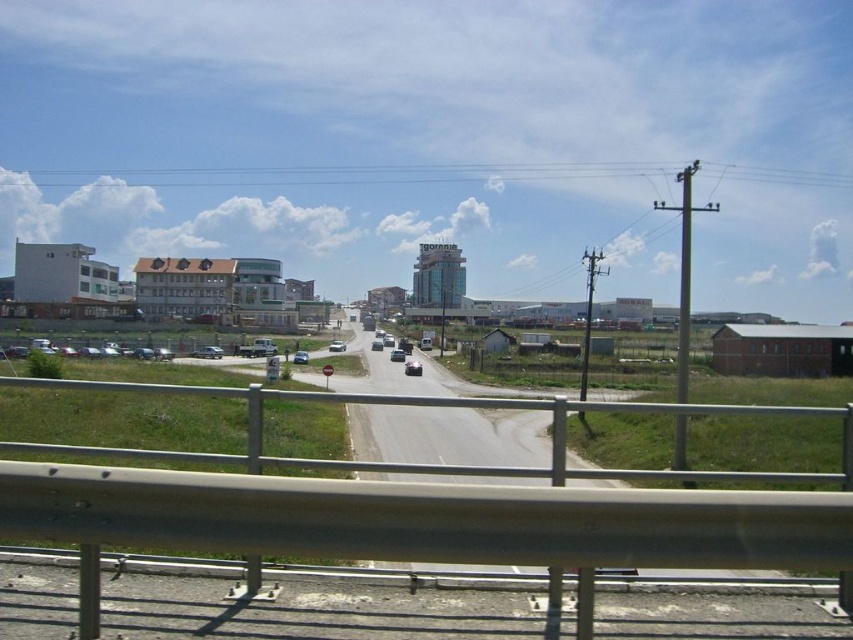
Is silver metallic sedan at center-left thinner than shiny silver sedan at center?

Yes, silver metallic sedan at center-left is thinner than shiny silver sedan at center.

Between silver metallic sedan at center-left and shiny silver sedan at center, which one has more height?

shiny silver sedan at center

Does point (198, 355) come behind point (401, 355)?

No, (198, 355) is in front of (401, 355).

Locate an element on the screen. silver metallic sedan at center-left is located at coordinates (207, 352).

Can you confirm if silver metallic sedan at center-left is positioned above shiny silver car at center?

Indeed, silver metallic sedan at center-left is positioned over shiny silver car at center.

How much distance is there between silver metallic sedan at center-left and shiny silver car at center?

silver metallic sedan at center-left and shiny silver car at center are 68.90 feet apart from each other.

Is point (213, 348) positioned behind point (405, 364)?

No, (213, 348) is in front of (405, 364).

Identify the location of silver metallic sedan at center-left. This screenshot has width=853, height=640. (207, 352).

Who is taller, silver metallic sedan at center-left or silver metallic sedan at center?

silver metallic sedan at center

In the scene shown: Who is lower down, silver metallic sedan at center-left or silver metallic sedan at center?

silver metallic sedan at center-left is lower down.

Who is more forward, (212, 353) or (344, 342)?

Positioned in front is point (212, 353).

Image resolution: width=853 pixels, height=640 pixels. I want to click on silver metallic sedan at center-left, so click(x=207, y=352).